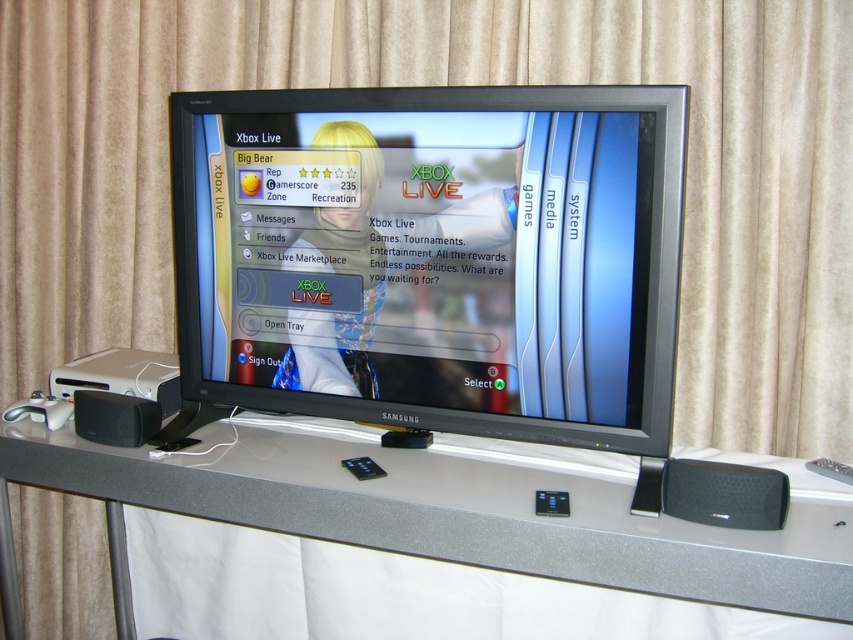
Question: Can you confirm if white glossy table at center is positioned below black mesh speaker at lower right?

Choices:
 (A) no
 (B) yes

Answer: (B)

Question: Which is nearer to the matte black monitor at center?

Choices:
 (A) black plastic speaker at lower left
 (B) black mesh speaker at lower right
 (C) white glossy table at center

Answer: (C)

Question: Does white glossy table at center have a larger size compared to black plastic speaker at lower left?

Choices:
 (A) yes
 (B) no

Answer: (A)

Question: Which of the following is the closest to the observer?

Choices:
 (A) (699, 483)
 (B) (840, 532)
 (C) (621, 168)
 (D) (122, 432)

Answer: (B)

Question: Which point appears farthest from the camera in this image?

Choices:
 (A) (438, 188)
 (B) (569, 557)

Answer: (A)

Question: Is black mesh speaker at lower right in front of black plastic speaker at lower left?

Choices:
 (A) yes
 (B) no

Answer: (A)